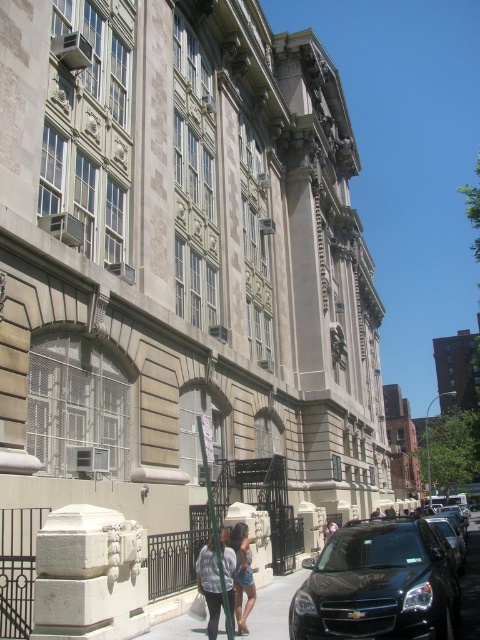
You are standing in front of the building and want to walk to the entrance. Which direction should you head from the smooth concrete pavement at center?

You should head towards the black wrought iron gates since they are the entrance to the building.

You are standing in front of the building and see a point at coordinates (379, 584). Based on the scene description, where is this point located?

The point is located on the black matte car at lower right.

You are a delivery person trying to park a 2.5 meter wide delivery truck in the courtyard. The courtyard has a smooth concrete pavement at center and a denim jacket at lower center. Which object can you use as a parking spot and why?

The smooth concrete pavement at center can be used as a parking spot because its width surpasses that of the denim jacket at lower center, making it wider and more suitable for accommodating the 2.5 meter wide delivery truck.